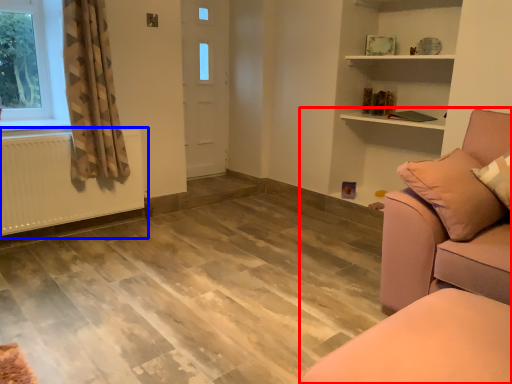
Question: Which of the following is the closest to the observer, studio couch (highlighted by a red box) or radiator (highlighted by a blue box)?

Choices:
 (A) studio couch
 (B) radiator

Answer: (A)